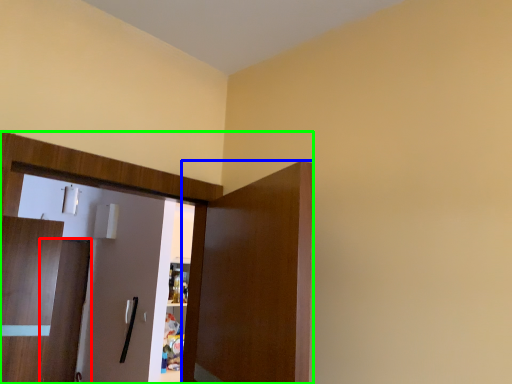
Question: Considering the real-world distances, which object is farthest from door (highlighted by a red box)? door (highlighted by a blue box) or dresser (highlighted by a green box)?

Choices:
 (A) door
 (B) dresser

Answer: (A)